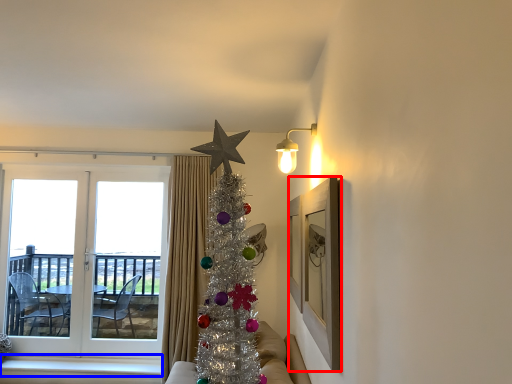
Question: Among these objects, which one is nearest to the camera, picture frame (highlighted by a red box) or window sill (highlighted by a blue box)?

Choices:
 (A) picture frame
 (B) window sill

Answer: (A)